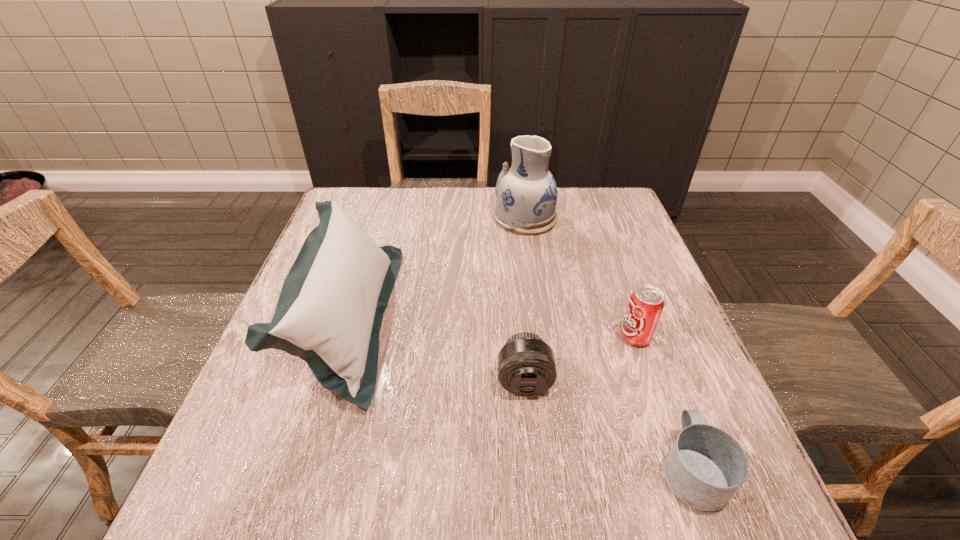
This screenshot has height=540, width=960. I want to click on object that is at the near right corner, so click(705, 467).

Identify the location of free space at the far edge of the desktop. (561, 197).

What are the coordinates of `vacant space at the near edge` in the screenshot? It's located at (408, 499).

Where is `free space at the right edge`? The width and height of the screenshot is (960, 540). free space at the right edge is located at coordinates (642, 245).

Where is `vacant space at the far left corner`? This screenshot has height=540, width=960. vacant space at the far left corner is located at coordinates (342, 190).

At what (x,y) coordinates should I click in order to perform the action: click on vacant space at the near left corner of the desktop. Please return your answer as a coordinate pair (x, y). This screenshot has height=540, width=960. Looking at the image, I should click on (232, 522).

The height and width of the screenshot is (540, 960). In order to click on blank space at the far right corner of the desktop in this screenshot , I will do `click(603, 188)`.

What are the coordinates of `free space between the pottery and the cushion` in the screenshot? It's located at (437, 268).

The width and height of the screenshot is (960, 540). What are the coordinates of `free space between the pottery and the fourth tallest object` in the screenshot? It's located at (525, 299).

In order to click on free space that is in between the soda and the fourth tallest object in this screenshot , I will do `click(580, 359)`.